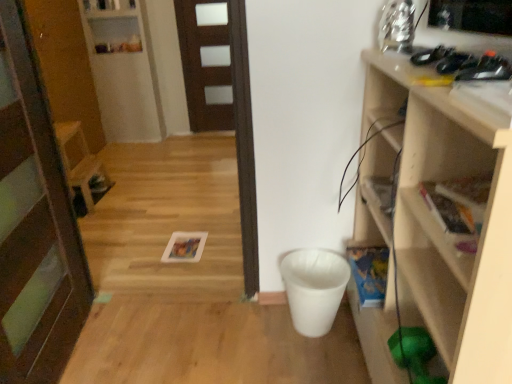
Question: From the image's perspective, is wooden chair at left located above or below white glossy shelf at upper left, which ranks as the 2th shelf in front-to-back order?

Choices:
 (A) below
 (B) above

Answer: (A)

Question: Is wooden chair at left in front of or behind white glossy shelf at upper left, the first shelf positioned from the left, in the image?

Choices:
 (A) front
 (B) behind

Answer: (A)

Question: Which is nearer to the white glossy shelf at upper left, the first shelf positioned from the left?

Choices:
 (A) wooden chair at left
 (B) wooden door at center, marked as the second door in a right-to-left arrangement
 (C) brown matte door at center, placed as the 1th door when sorted from back to front
 (D) wooden shelf at right, marked as the 1th shelf in a front-to-back arrangement

Answer: (C)

Question: Which of these objects is positioned closest to the wooden door at center, which ranks as the 1th door in left-to-right order?

Choices:
 (A) wooden chair at left
 (B) white glossy shelf at upper left, marked as the 1th shelf in a top-to-bottom arrangement
 (C) wooden shelf at right, acting as the first shelf starting from the bottom
 (D) brown matte door at center, acting as the first door starting from the right

Answer: (C)